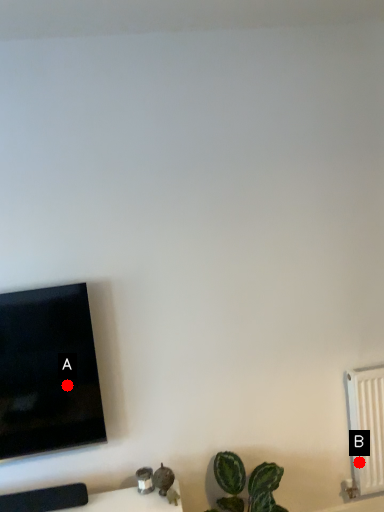
Question: Two points are circled on the image, labeled by A and B beside each circle. Which of the following is the farthest from the observer?

Choices:
 (A) A is further
 (B) B is further

Answer: (B)